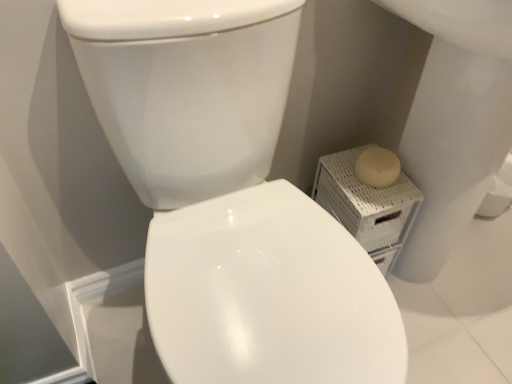
Question: Is beige wicker basket at right to the left or to the right of white glossy bidet at center in the image?

Choices:
 (A) left
 (B) right

Answer: (A)

Question: Choose the correct answer: Is beige wicker basket at right inside white glossy bidet at center or outside it?

Choices:
 (A) outside
 (B) inside

Answer: (A)

Question: Estimate the real-world distances between objects in this image. Which object is farther from the beige wicker basket at right?

Choices:
 (A) white glossy bidet at center
 (B) white glossy toilet at center

Answer: (B)

Question: Based on their relative distances, which object is farther from the beige wicker basket at right?

Choices:
 (A) white glossy bidet at center
 (B) white glossy toilet at center

Answer: (B)